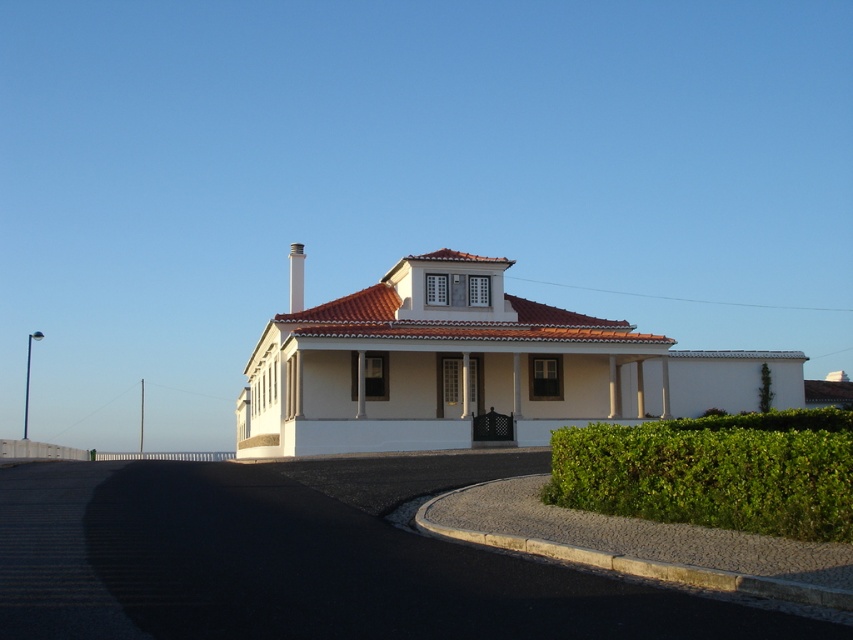
Question: Can you confirm if green leafy hedge at lower right is positioned below white smooth chimney at center?

Choices:
 (A) yes
 (B) no

Answer: (A)

Question: Does green leafy hedge at lower right appear under white smooth chimney at center?

Choices:
 (A) yes
 (B) no

Answer: (A)

Question: Can you confirm if black asphalt at center is positioned to the right of green leafy hedge at lower right?

Choices:
 (A) no
 (B) yes

Answer: (A)

Question: Which point is farther to the camera?

Choices:
 (A) (299, 304)
 (B) (440, 632)
 (C) (675, 465)

Answer: (A)

Question: Which of the following is the closest to the observer?

Choices:
 (A) green leafy hedge at lower right
 (B) white smooth chimney at center
 (C) black asphalt at center

Answer: (C)

Question: Which object appears farthest from the camera in this image?

Choices:
 (A) green leafy hedge at lower right
 (B) white smooth chimney at center
 (C) black asphalt at center

Answer: (B)